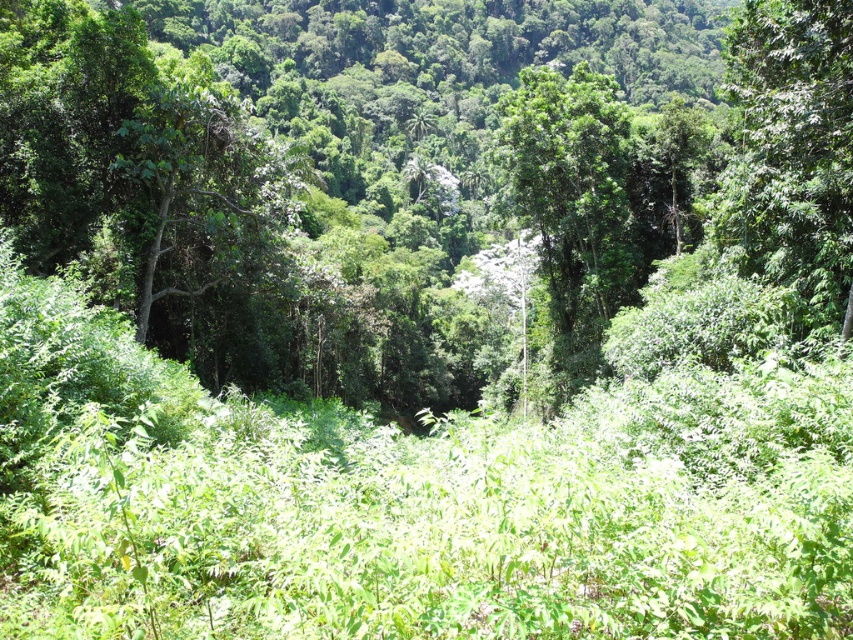
You are a hiker navigating through the forest and want to reach the green leafy tree at center. Which direction should you move to get closer to it from your current position near the green leafy tree at upper right?

Since the green leafy tree at upper right is closer to the viewer than the green leafy tree at center, you should move towards the center of the forest away from the green leafy tree at upper right to reach the green leafy tree at center.

You are standing in the forest and see a point marked as point (791, 148). What does this point represent?

The point (791, 148) represents the green leafy tree at upper right.